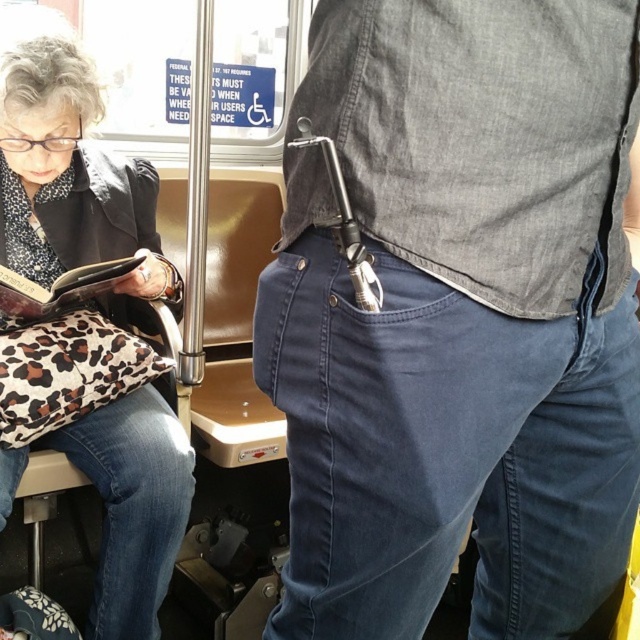
Looking at this image, you are a passenger on a train and need to place a 15 cm wide item. You see a metallic silver tool at center and a leopard print fabric book at left. Which object can you place your item next to without it overlapping?

The metallic silver tool at center is larger in size than the leopard print fabric book at left, so placing the 15 cm item next to the metallic silver tool at center would be more suitable as it has more space available.

You are standing in the subway car and want to pick up the leopard print fabric purse at lower left. Can you reach it without moving your feet?

The leopard print fabric purse at lower left is 3.76 feet away from you, so you cannot reach it without moving your feet.

You are standing in the public transportation vehicle and want to reach the point at coordinates (588, 560). If your arm can extend 30 inches, can you comfortably reach that point?

The point at coordinates (588, 560) is 31.91 inches away from the viewer. Since your arm can only extend 30 inches, you cannot comfortably reach that point.